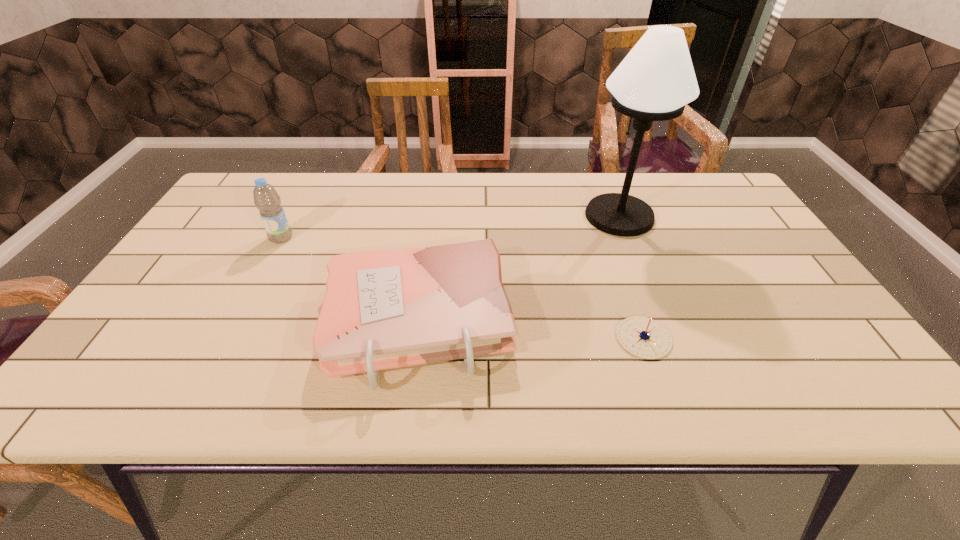
Where is `object located in the far edge section of the desktop`? The image size is (960, 540). object located in the far edge section of the desktop is located at coordinates tap(654, 82).

Identify the location of object located in the near edge section of the desktop. Image resolution: width=960 pixels, height=540 pixels. (384, 309).

Identify the location of free region at the far edge of the desktop. (591, 176).

At what (x,y) coordinates should I click in order to perform the action: click on vacant region at the near edge of the desktop. Please return your answer as a coordinate pair (x, y). The width and height of the screenshot is (960, 540). Looking at the image, I should click on (451, 392).

The width and height of the screenshot is (960, 540). In the image, there is a desktop. Find the location of `free space at the right edge`. free space at the right edge is located at coordinates (712, 221).

Find the location of `free space at the far right corner of the desktop`. free space at the far right corner of the desktop is located at coordinates (708, 190).

Identify the location of vacant region at the near right corner of the desktop. This screenshot has height=540, width=960. (807, 372).

Where is `vacant point located between the table lamp and the compass`? This screenshot has height=540, width=960. vacant point located between the table lamp and the compass is located at coordinates (632, 277).

You are a GUI agent. You are given a task and a screenshot of the screen. Output one action in this format:
    pyautogui.click(x=<x>, y=<y>)
    Task: Click on the vacant area between the compass and the table lamp
    This screenshot has width=960, height=540.
    Given the screenshot: What is the action you would take?
    pyautogui.click(x=632, y=277)

Find the location of a particular element. free spot between the compass and the tallest object is located at coordinates (632, 277).